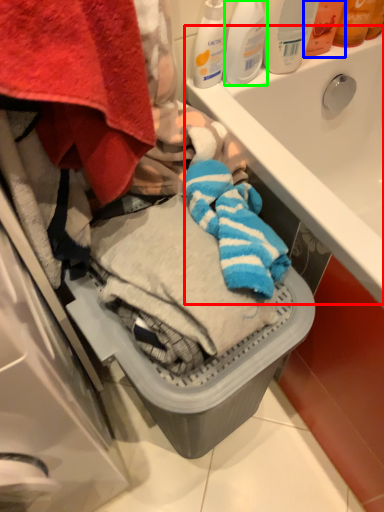
Question: Considering the real-world distances, which object is farthest from sink (highlighted by a red box)? toiletry (highlighted by a blue box) or cleaning product (highlighted by a green box)?

Choices:
 (A) toiletry
 (B) cleaning product

Answer: (B)